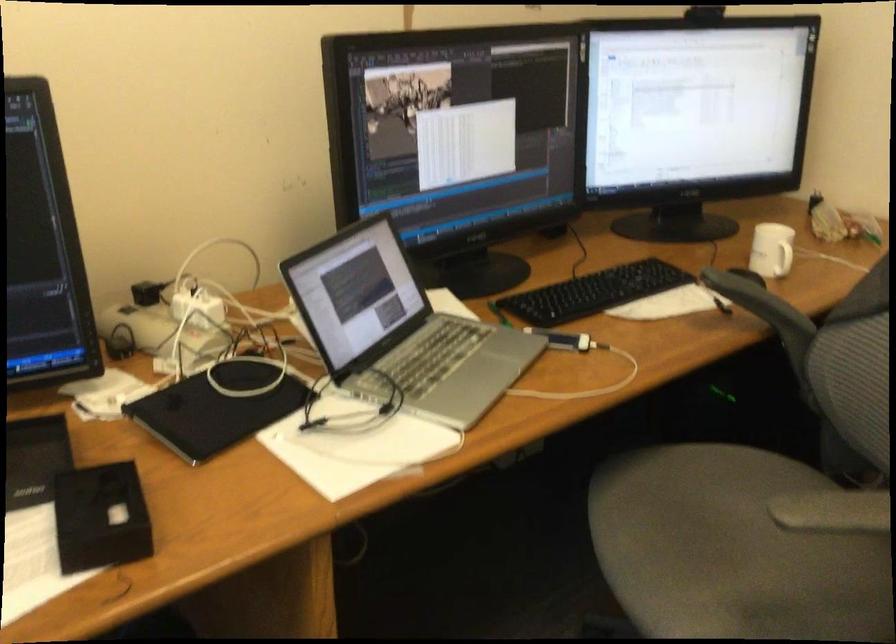
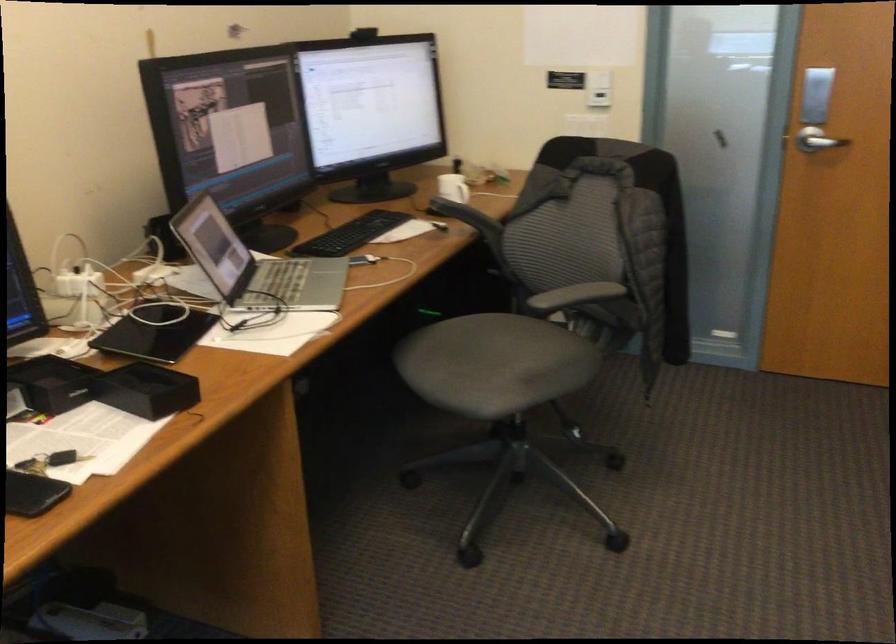
Question: The camera is either moving clockwise (left) or counter-clockwise (right) around the object. The first image is from the beginning of the video and the second image is from the end. Is the camera moving left or right when shooting the video?

Choices:
 (A) Left
 (B) Right

Answer: (A)